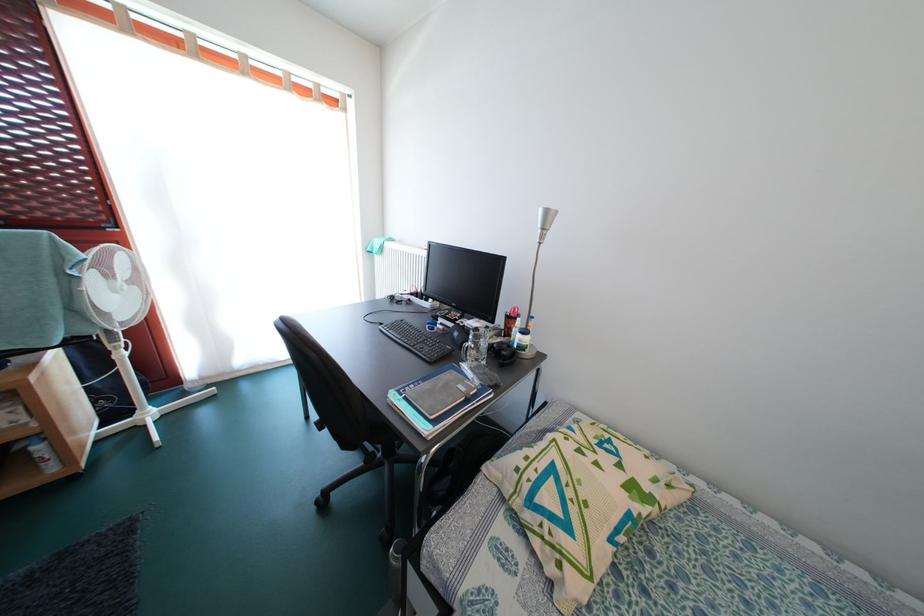
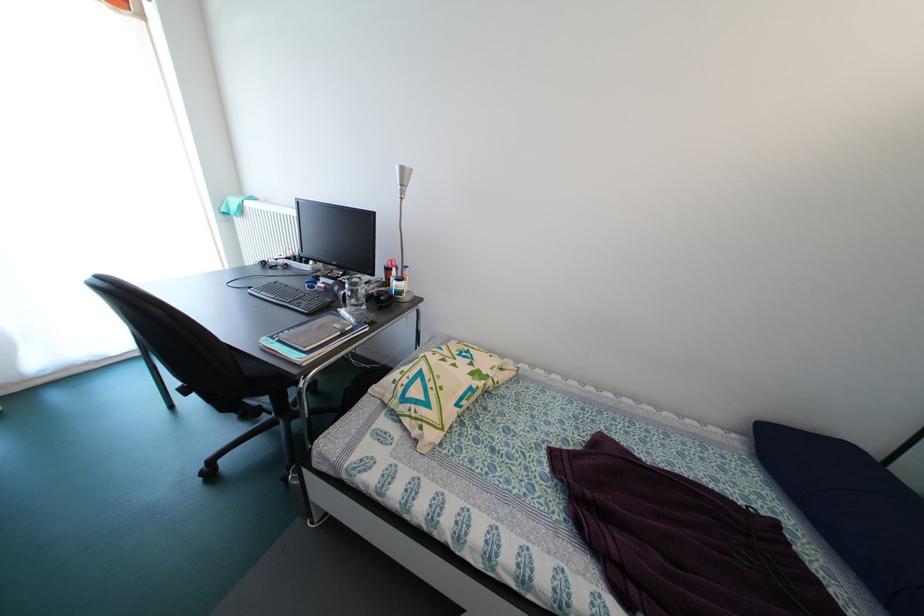
In the second image, find the point that corresponds to the point at 483,365 in the first image.

(362, 310)